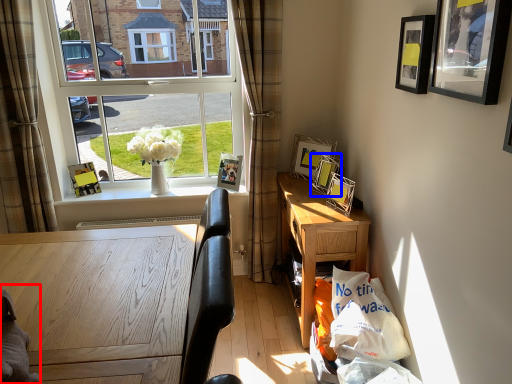
Question: Which of the following is the closest to the observer, animal (highlighted by a red box) or picture frame (highlighted by a blue box)?

Choices:
 (A) animal
 (B) picture frame

Answer: (A)